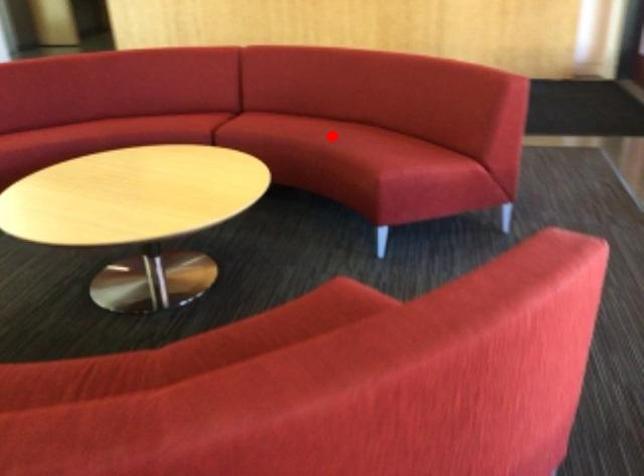
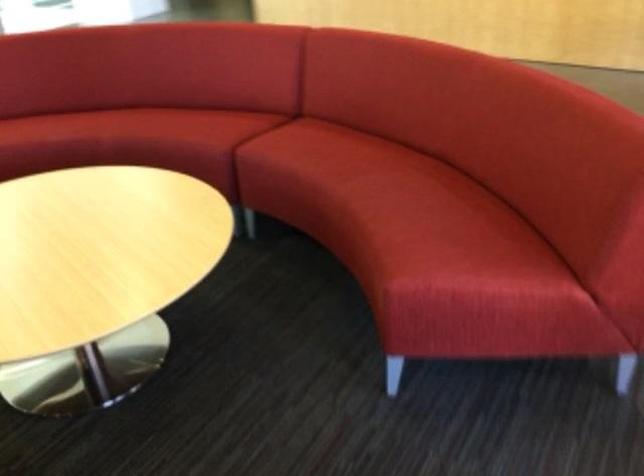
Question: A red point is marked in image1. In image2, is the corresponding 3D point closer to the camera or farther? Reply with the corresponding letter.

Choices:
 (A) The corresponding 3D point is closer.
 (B) The corresponding 3D point is farther.

Answer: (A)